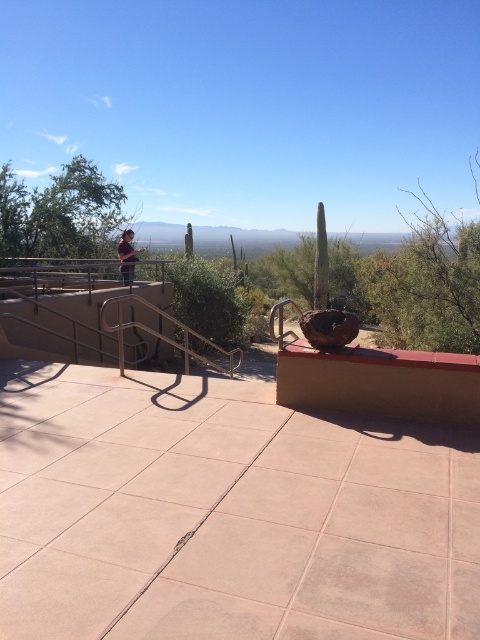
Consider the image. Is green leafy bush at upper left behind matte brown shirt at upper left?

Yes, it is.

Who is more distant from viewer, (107,230) or (131,257)?

The point (107,230) is behind.

Locate an element on the screen. green leafy bush at upper left is located at coordinates (60, 212).

Is brown concrete ledge at lower right to the right of green leafy bush at upper left from the viewer's perspective?

Correct, you'll find brown concrete ledge at lower right to the right of green leafy bush at upper left.

Does brown concrete ledge at lower right have a greater width compared to green leafy bush at upper left?

In fact, brown concrete ledge at lower right might be narrower than green leafy bush at upper left.

Find the location of a particular element. brown concrete ledge at lower right is located at coordinates (380, 381).

Does brown concrete ledge at lower right appear on the right side of matte brown shirt at upper left?

Correct, you'll find brown concrete ledge at lower right to the right of matte brown shirt at upper left.

Who is higher up, brown concrete ledge at lower right or matte brown shirt at upper left?

Positioned higher is matte brown shirt at upper left.

Is point (300, 369) less distant than point (120, 266)?

Yes.

Find the location of a particular element. Image resolution: width=480 pixels, height=640 pixels. brown concrete ledge at lower right is located at coordinates (380, 381).